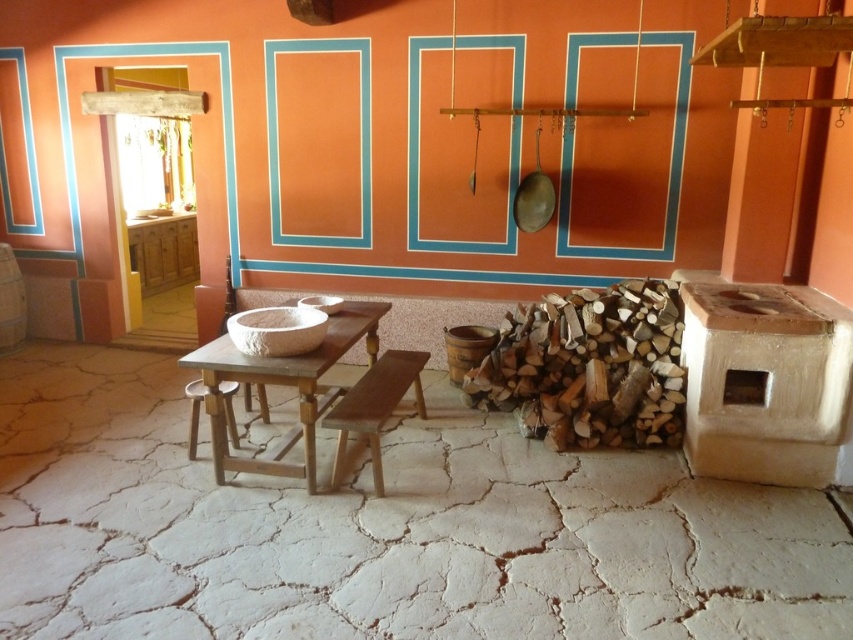
From the picture: You are planning to place a large platter of food on the wooden table at center and the wooden stool at lower left. Which surface can accommodate the platter without it hanging over the edge?

The wooden table at center can accommodate the platter without it hanging over the edge because it is larger in size than the wooden stool at lower left.

From the picture: You are standing in the rustic kitchen and need to place a large pot on the wooden table at center. Given that the table is at coordinates 0.602 on the x and 0.333 on the y axis, can you confirm its exact location?

The wooden table at center is located at coordinates x 0.602 and y 0.333.